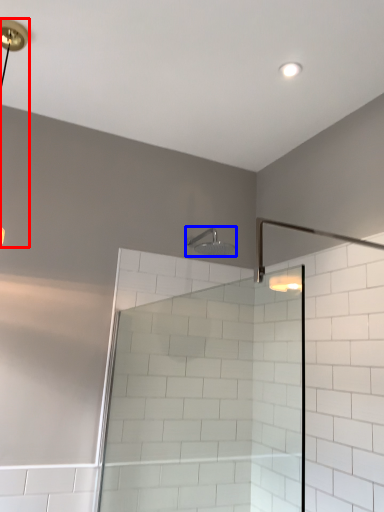
Question: Which of the following is the farthest to the observer, lamp (highlighted by a red box) or shower (highlighted by a blue box)?

Choices:
 (A) lamp
 (B) shower

Answer: (B)